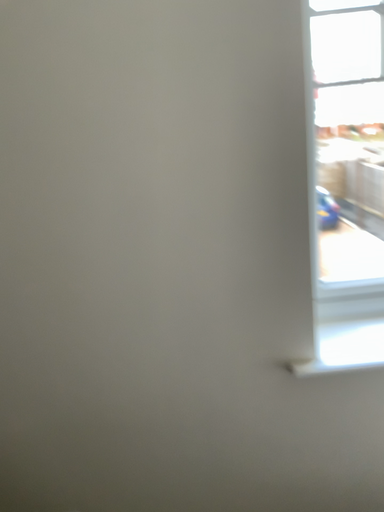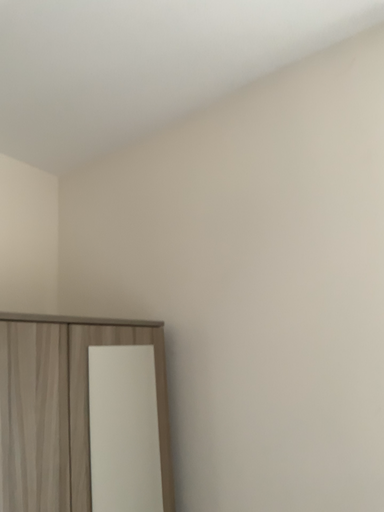
Question: How did the camera likely rotate when shooting the video?

Choices:
 (A) rotated upward
 (B) rotated downward

Answer: (A)